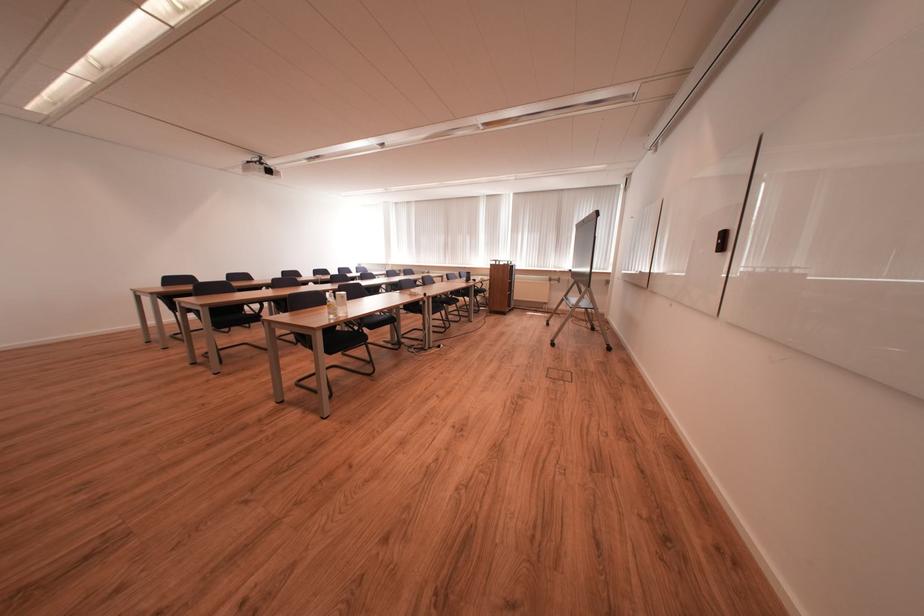
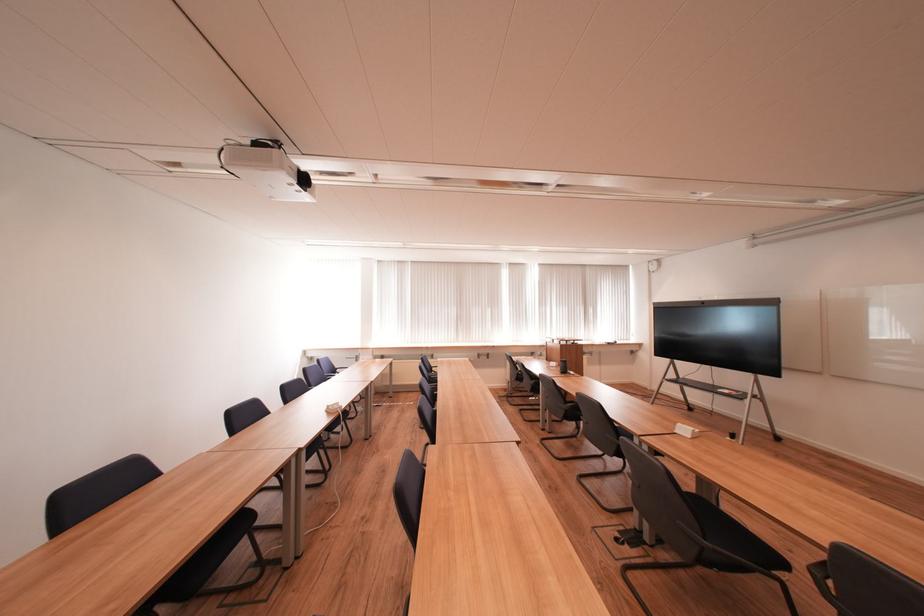
Question: I am providing you with two images of the same scene from different viewpoints. Which of the following objects are not visible in image2?

Choices:
 (A) black chair sitting surface
 (B) white nameplate holder
 (C) purple scissors handle
 (D) floor socket cover

Answer: (D)